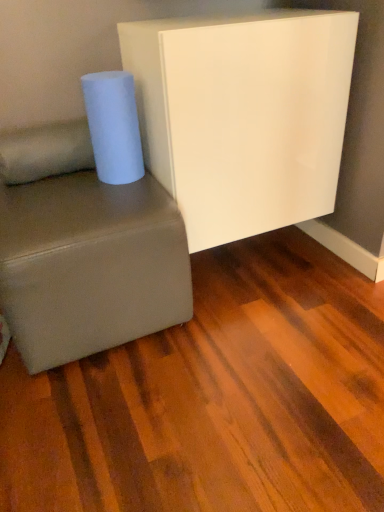
Question: Would you say soft beige fabric pillow at lower left contains suede-like gray studio couch at lower left?

Choices:
 (A) yes
 (B) no

Answer: (B)

Question: Is soft beige fabric pillow at lower left placed right next to suede-like gray studio couch at lower left?

Choices:
 (A) yes
 (B) no

Answer: (B)

Question: From the image's perspective, would you say soft beige fabric pillow at lower left is shown under suede-like gray studio couch at lower left?

Choices:
 (A) no
 (B) yes

Answer: (A)

Question: From the image's perspective, is soft beige fabric pillow at lower left located above suede-like gray studio couch at lower left?

Choices:
 (A) no
 (B) yes

Answer: (B)

Question: Considering the relative sizes of soft beige fabric pillow at lower left and suede-like gray studio couch at lower left in the image provided, is soft beige fabric pillow at lower left wider than suede-like gray studio couch at lower left?

Choices:
 (A) no
 (B) yes

Answer: (A)

Question: Would you say white matte paper towel at left is inside or outside soft beige fabric pillow at lower left?

Choices:
 (A) outside
 (B) inside

Answer: (A)

Question: Based on their sizes in the image, would you say white matte paper towel at left is bigger or smaller than soft beige fabric pillow at lower left?

Choices:
 (A) big
 (B) small

Answer: (B)

Question: From the image's perspective, is white matte paper towel at left positioned above or below soft beige fabric pillow at lower left?

Choices:
 (A) above
 (B) below

Answer: (A)

Question: From a real-world perspective, is white matte paper towel at left positioned above or below soft beige fabric pillow at lower left?

Choices:
 (A) above
 (B) below

Answer: (A)

Question: Considering their positions, is soft beige fabric pillow at lower left located in front of or behind suede-like gray studio couch at lower left?

Choices:
 (A) behind
 (B) front

Answer: (A)

Question: In terms of size, does soft beige fabric pillow at lower left appear bigger or smaller than suede-like gray studio couch at lower left?

Choices:
 (A) small
 (B) big

Answer: (A)

Question: Looking at their shapes, would you say soft beige fabric pillow at lower left is wider or thinner than suede-like gray studio couch at lower left?

Choices:
 (A) wide
 (B) thin

Answer: (B)

Question: From a real-world perspective, is soft beige fabric pillow at lower left positioned above or below suede-like gray studio couch at lower left?

Choices:
 (A) above
 (B) below

Answer: (A)

Question: In terms of width, does suede-like gray studio couch at lower left look wider or thinner when compared to soft beige fabric pillow at lower left?

Choices:
 (A) thin
 (B) wide

Answer: (B)

Question: Choose the correct answer: Is suede-like gray studio couch at lower left inside soft beige fabric pillow at lower left or outside it?

Choices:
 (A) inside
 (B) outside

Answer: (B)